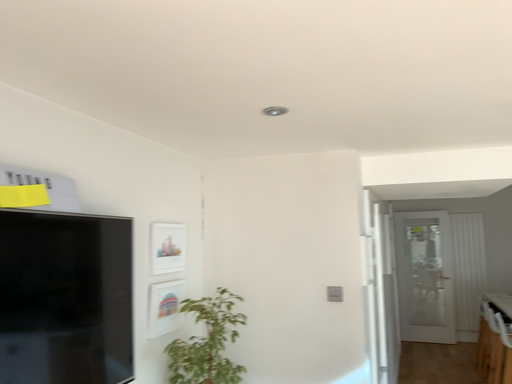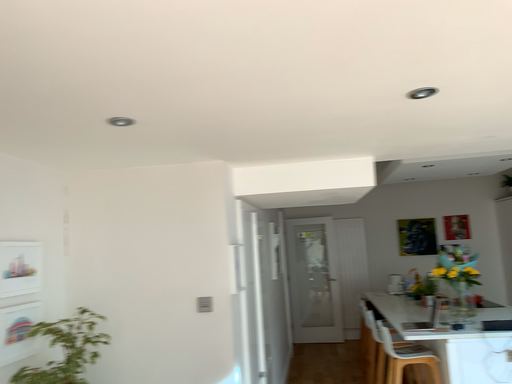
Question: How did the camera likely rotate when shooting the video?

Choices:
 (A) rotated right
 (B) rotated left

Answer: (A)